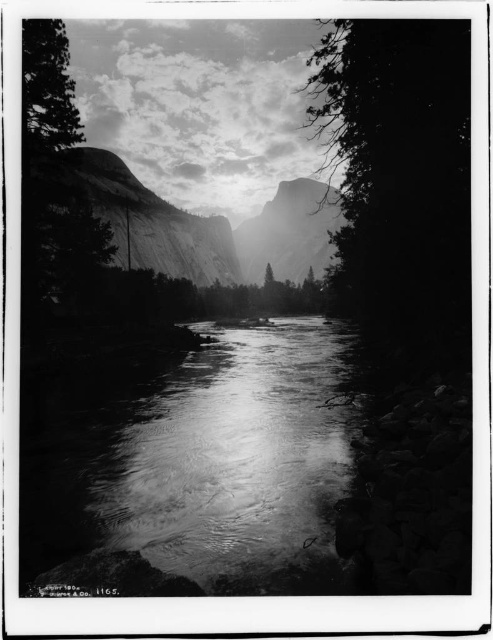
You are planning to take a photo of the smooth granite mountain at center and the smooth bark tree at left. Which object should you focus on first if you want to capture both in a single frame without moving the camera?

The smooth granite mountain at center is larger in size than the smooth bark tree at left, so you should focus on the smooth granite mountain at center first to ensure it fits properly in the frame before adjusting for the smaller tree.

You are standing at the edge of the flowing river in the foreground of this serene landscape. You notice two points marked in the image. Which of the two points, point [203,458] or point [76,124], is closer to your current position?

Point [203,458] is closer to the viewer than point [76,124], so the point closer to your current position is point [203,458].

You are standing at the point closest to the river in the image. Which of the two points, point (317, 193) or point (63, 48), is farther away from you?

Point (317, 193) is farther away because it is behind point (63, 48).